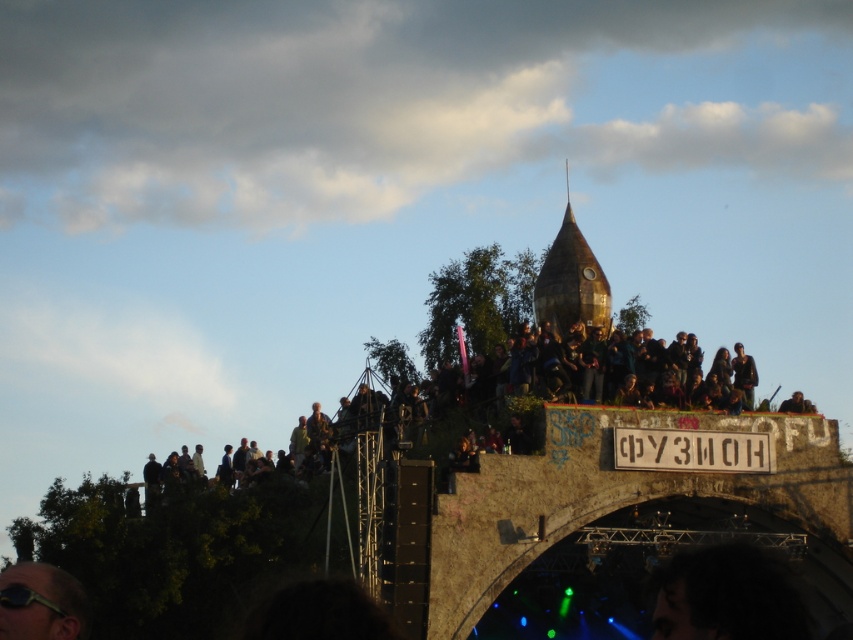
Who is positioned more to the left, gold metallic dome at center or matte black sunglasses at lower left?

matte black sunglasses at lower left is more to the left.

Consider the image. Is gold metallic dome at center in front of matte black sunglasses at lower left?

No, it is behind matte black sunglasses at lower left.

Which is in front, point (546, 312) or point (39, 628)?

Point (39, 628) is more forward.

Find the location of a particular element. Image resolution: width=853 pixels, height=640 pixels. gold metallic dome at center is located at coordinates (572, 282).

Does stone bridge at upper center appear on the left side of matte black sunglasses at lower left?

Incorrect, stone bridge at upper center is not on the left side of matte black sunglasses at lower left.

Between point (462, 516) and point (26, 618), which one is positioned in front?

Positioned in front is point (26, 618).

Is point (820, 563) farther from camera compared to point (13, 566)?

Yes, it is behind point (13, 566).

The height and width of the screenshot is (640, 853). Find the location of `stone bridge at upper center`. stone bridge at upper center is located at coordinates (635, 497).

Is stone bridge at upper center smaller than gold metallic dome at center?

Answer: Incorrect, stone bridge at upper center is not smaller in size than gold metallic dome at center.

Can you confirm if stone bridge at upper center is positioned above gold metallic dome at center?

Incorrect, stone bridge at upper center is not positioned above gold metallic dome at center.

I want to click on stone bridge at upper center, so click(635, 497).